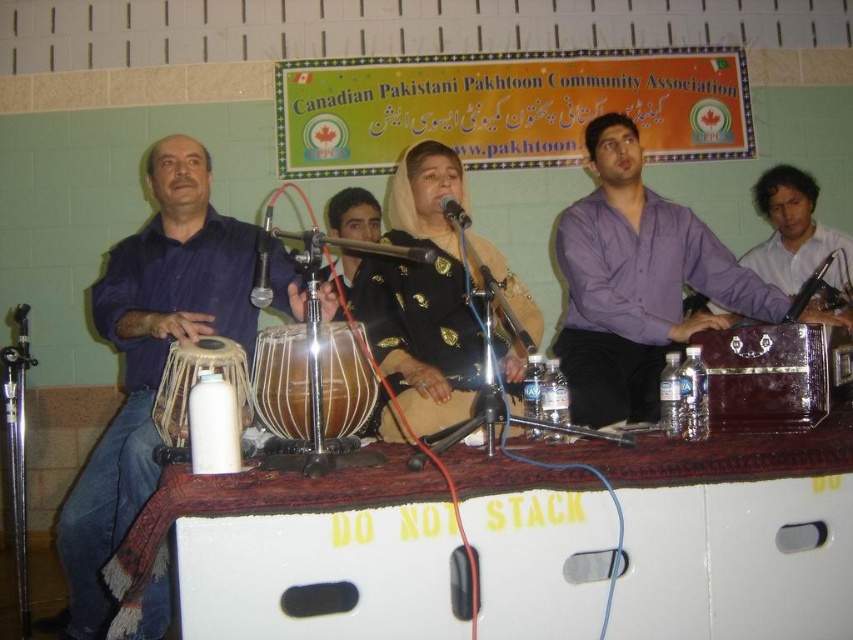
Question: Which object is farther from the camera taking this photo?

Choices:
 (A) blue fabric at left
 (B) light brown wooden drum at left
 (C) purple shiny suitcase at center
 (D) wooden drum at center

Answer: (C)

Question: Is wooden drum at center to the left of light brown wooden drum at left from the viewer's perspective?

Choices:
 (A) yes
 (B) no

Answer: (B)

Question: Which of these objects is positioned farthest from the wooden drum at center?

Choices:
 (A) black satin dress at center
 (B) light brown wooden drum at left
 (C) blue fabric at left
 (D) purple shiny suitcase at center

Answer: (D)

Question: Estimate the real-world distances between objects in this image. Which object is farther from the blue fabric at left?

Choices:
 (A) purple shiny suitcase at center
 (B) wooden drum at center
 (C) light brown wooden drum at left

Answer: (A)

Question: Can you confirm if purple shiny suitcase at center is positioned to the left of black satin dress at center?

Choices:
 (A) no
 (B) yes

Answer: (A)

Question: Does blue fabric at left lie behind black satin dress at center?

Choices:
 (A) no
 (B) yes

Answer: (A)